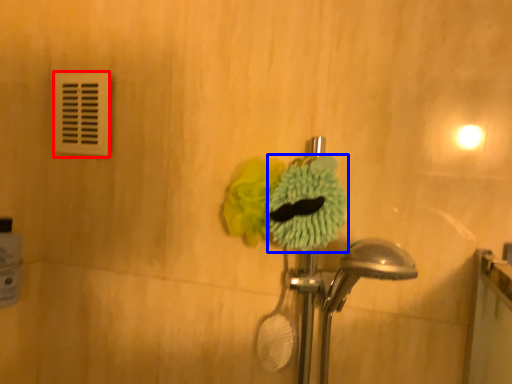
Question: Which of the following is the farthest to the observer, light switch (highlighted by a red box) or flower (highlighted by a blue box)?

Choices:
 (A) light switch
 (B) flower

Answer: (A)